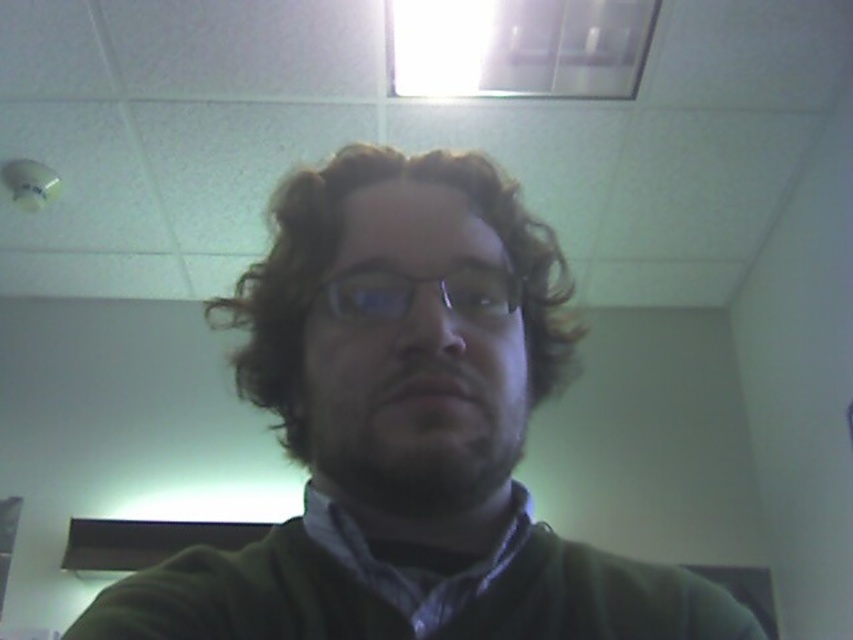
You are standing in the room and want to move from the point at coordinates point (563, 573) to the point at coordinates point (358, 428). Can you walk directly between them without any obstacles?

Point (563, 573) is behind point (358, 428), so you cannot walk directly between them without obstacles.

You are a photographer adjusting the lighting in the room. You notice the green matte sweater at center and the dark brown fuzzy beard at center. Which object is closer to the camera lens?

The dark brown fuzzy beard at center is closer to the camera lens because the green matte sweater at center is positioned under it, indicating the beard is in front.